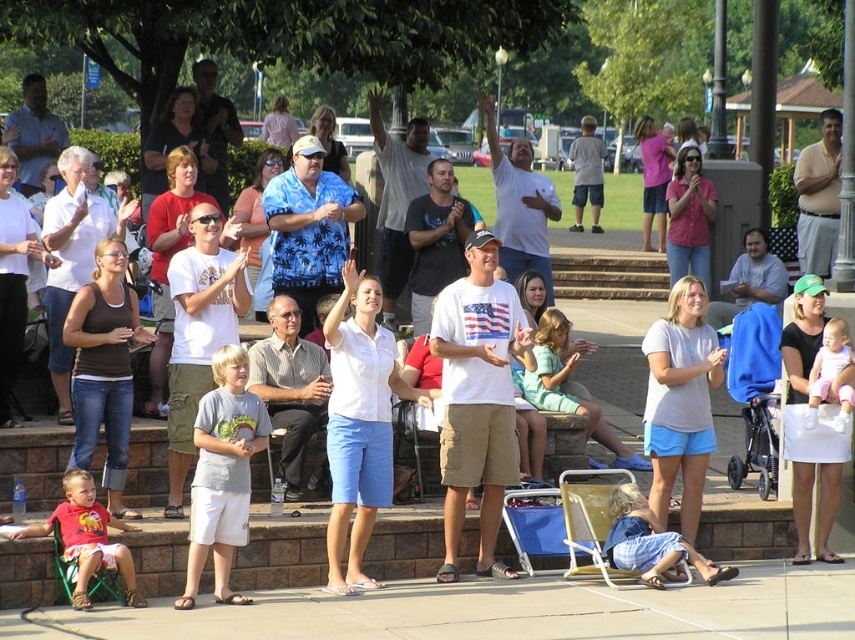
Can you confirm if denim shorts at lower center is thinner than pink fabric baby at center?

No.

Describe the element at coordinates (650, 541) in the screenshot. This screenshot has height=640, width=855. I see `denim shorts at lower center` at that location.

Between point (696, 560) and point (836, 330), which one is positioned in front?

Positioned in front is point (696, 560).

Identify the location of denim shorts at lower center. The width and height of the screenshot is (855, 640). (650, 541).

Does gray cotton shirt at center appear on the right side of matte red shirt at lower left?

Yes, gray cotton shirt at center is to the right of matte red shirt at lower left.

Find the location of a particular element. gray cotton shirt at center is located at coordinates (222, 474).

How far apart are matte red shirt at lower left and denim shorts at lower center?

matte red shirt at lower left and denim shorts at lower center are 6.73 meters apart from each other.

You are a GUI agent. You are given a task and a screenshot of the screen. Output one action in this format:
    pyautogui.click(x=<x>, y=<y>)
    Task: Click on the matte red shirt at lower left
    
    Given the screenshot: What is the action you would take?
    pyautogui.click(x=87, y=538)

Which is in front, point (96, 508) or point (612, 532)?

Point (96, 508) is more forward.

The height and width of the screenshot is (640, 855). I want to click on matte red shirt at lower left, so click(x=87, y=538).